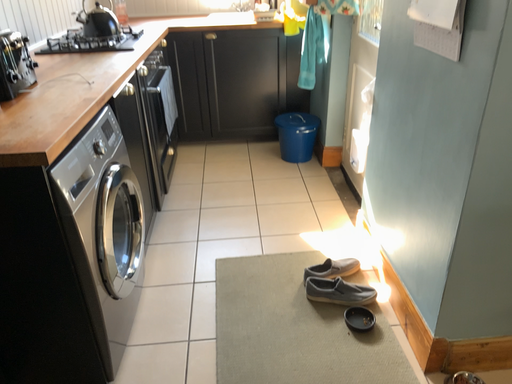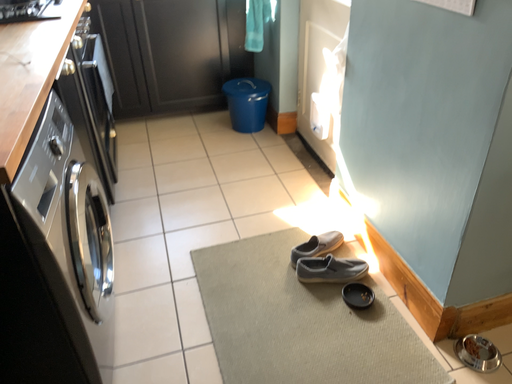
Question: How did the camera likely rotate when shooting the video?

Choices:
 (A) rotated left
 (B) rotated right

Answer: (B)